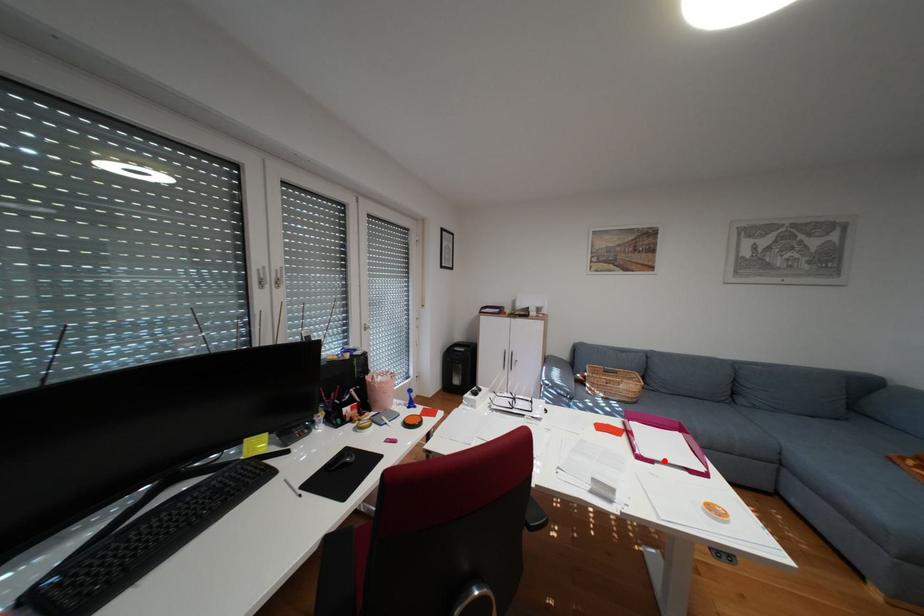
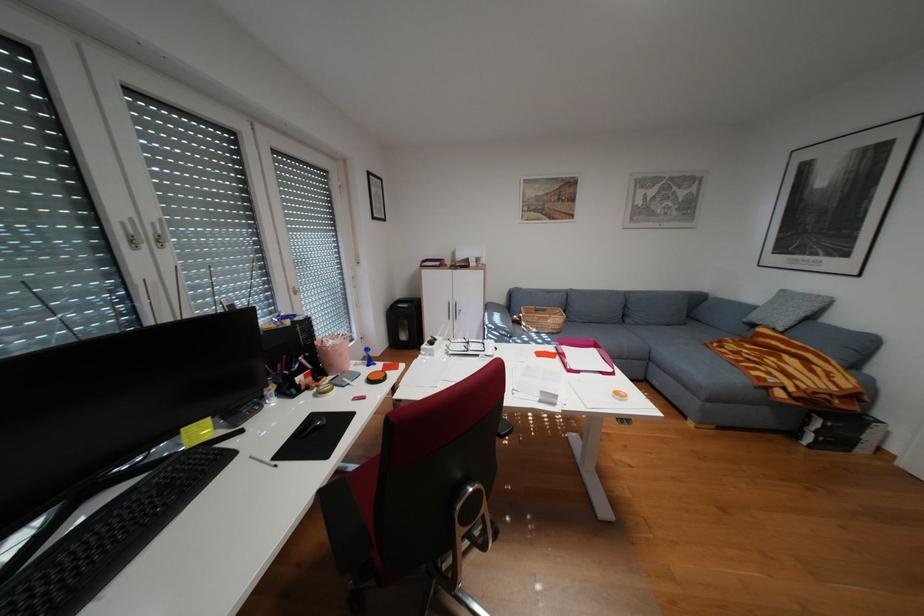
In the second image, find the point that corresponds to the highlighted location in the first image.

(590, 371)